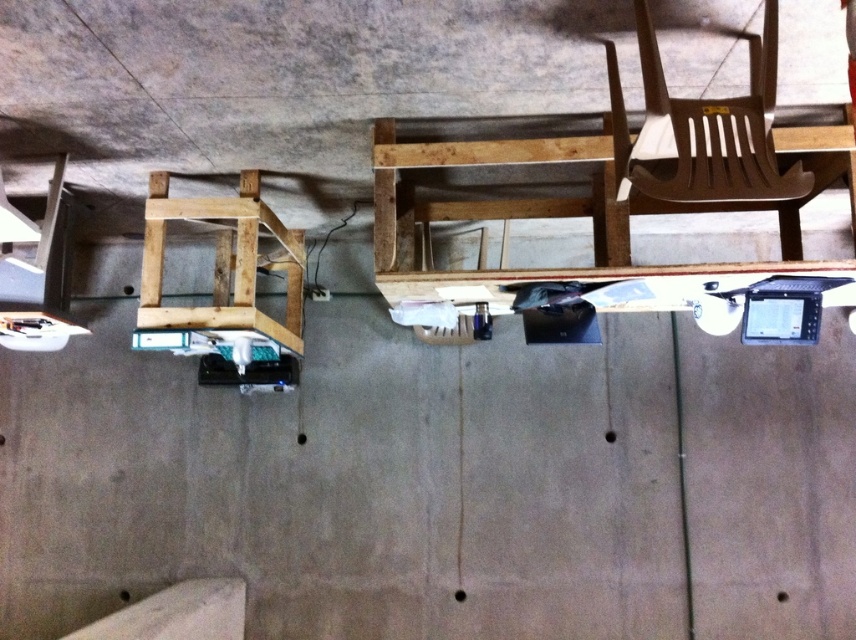
You are setting up a workstation in the room. You need to place the mahogany wood chair at upper right so it faces the white matte ramp at lower left. Is the chair positioned to the left or right of the ramp?

The mahogany wood chair at upper right is positioned to the right of the white matte ramp at lower left, so it is facing away from the ramp. To face the ramp, the chair should be on the left side of the ramp.

You are a delivery person trying to reach the white matte ramp at lower left to place a package. However, there is a natural wood stool at left in the way. Can you move around the stool to access the ramp?

The white matte ramp at lower left is behind the natural wood stool at left, so you can move around the stool to access the ramp since it is positioned behind it.